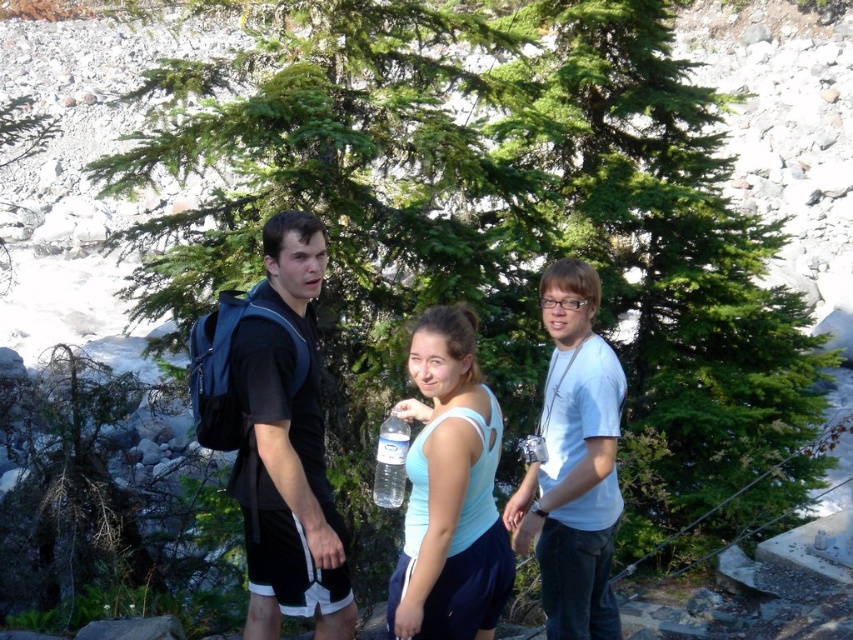
You are a photographer trying to capture a clear photo of the white matte shirt at center and the clear plastic bottle at center. Which object should you focus on first if you want to ensure both are in focus, considering their sizes?

The white matte shirt at center has a greater height compared to the clear plastic bottle at center, so you should focus on the white matte shirt at center first as it is larger and requires more precise focusing to ensure both are in focus.

You are a photographer trying to capture the white matte shirt at center and the clear plastic bottle at center in a single shot. Which object will appear larger in the photo?

The white matte shirt at center will appear larger in the photo because it is closer to the viewer than the clear plastic bottle at center.